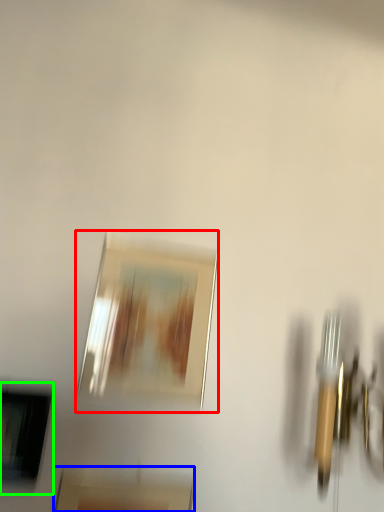
Question: Which object is positioned closest to picture frame (highlighted by a red box)? Select from picture frame (highlighted by a blue box) and picture frame (highlighted by a green box).

Choices:
 (A) picture frame
 (B) picture frame

Answer: (B)